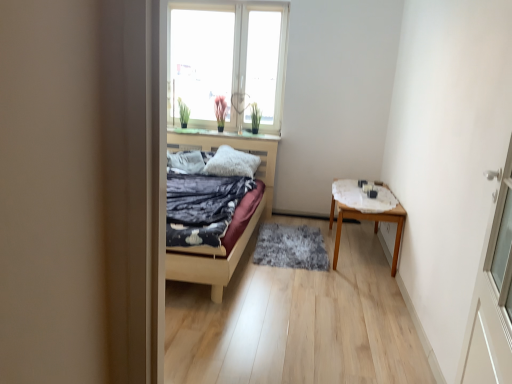
Question: Does gray shaggy rug at center have a smaller size compared to white textured table at right?

Choices:
 (A) yes
 (B) no

Answer: (B)

Question: Is gray shaggy rug at center turned away from white textured table at right?

Choices:
 (A) no
 (B) yes

Answer: (A)

Question: Is gray shaggy rug at center at the left side of white textured table at right?

Choices:
 (A) yes
 (B) no

Answer: (A)

Question: Is gray shaggy rug at center to the right of white textured table at right from the viewer's perspective?

Choices:
 (A) no
 (B) yes

Answer: (A)

Question: Is gray shaggy rug at center wider than white textured table at right?

Choices:
 (A) yes
 (B) no

Answer: (A)

Question: Is point (187, 158) positioned closer to the camera than point (279, 256)?

Choices:
 (A) farther
 (B) closer

Answer: (A)

Question: In the image, is textured gray pillow at center, which is the 1th pillow in left-to-right order, on the left side or the right side of gray shaggy rug at center?

Choices:
 (A) right
 (B) left

Answer: (B)

Question: From the image's perspective, is textured gray pillow at center, which is the 1th pillow in left-to-right order, above or below gray shaggy rug at center?

Choices:
 (A) below
 (B) above

Answer: (B)

Question: In the image, is textured gray pillow at center, the 2th pillow viewed from the right, positioned in front of or behind gray shaggy rug at center?

Choices:
 (A) front
 (B) behind

Answer: (B)

Question: Considering the relative positions of white textured table at right and white fluffy pillow at center, arranged as the 1th pillow when viewed from the right, in the image provided, is white textured table at right to the left or to the right of white fluffy pillow at center, arranged as the 1th pillow when viewed from the right,?

Choices:
 (A) right
 (B) left

Answer: (A)

Question: Based on their sizes in the image, would you say white textured table at right is bigger or smaller than white fluffy pillow at center, positioned as the 2th pillow in left-to-right order?

Choices:
 (A) big
 (B) small

Answer: (B)

Question: Is white textured table at right taller or shorter than white fluffy pillow at center, positioned as the 2th pillow in left-to-right order?

Choices:
 (A) short
 (B) tall

Answer: (A)

Question: Is white textured table at right in front of or behind white fluffy pillow at center, positioned as the 2th pillow in left-to-right order, in the image?

Choices:
 (A) front
 (B) behind

Answer: (A)

Question: From a real-world perspective, is white fluffy pillow at center, positioned as the 2th pillow in left-to-right order, positioned above or below white textured table at right?

Choices:
 (A) below
 (B) above

Answer: (B)

Question: In terms of height, does white fluffy pillow at center, positioned as the 2th pillow in left-to-right order, look taller or shorter compared to white textured table at right?

Choices:
 (A) short
 (B) tall

Answer: (B)